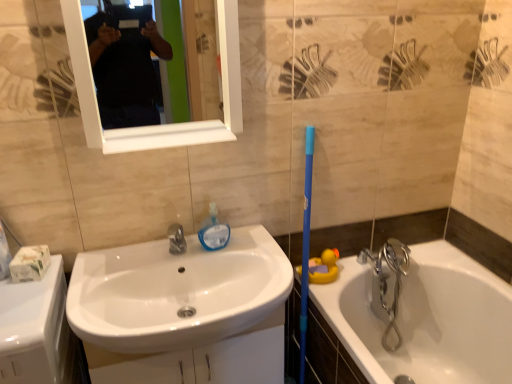
At what (x,y) coordinates should I click in order to perform the action: click on free space in front of yellow rubber duck at lower right. Please return your answer as a coordinate pair (x, y). The width and height of the screenshot is (512, 384). Looking at the image, I should click on (330, 301).